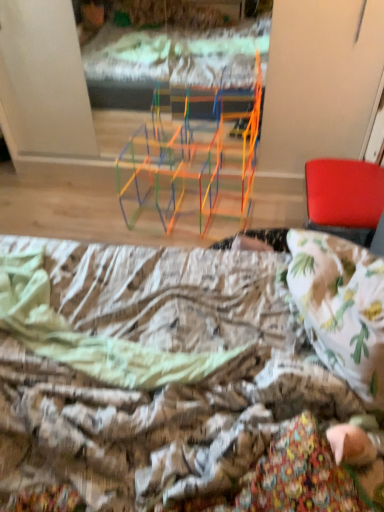
Question: Looking at their shapes, would you say red leather chair at right is wider or thinner than printed fabric bed at lower center?

Choices:
 (A) wide
 (B) thin

Answer: (B)

Question: Visually, is red leather chair at right positioned to the left or to the right of printed fabric bed at lower center?

Choices:
 (A) right
 (B) left

Answer: (A)

Question: From the image's perspective, is red leather chair at right above or below printed fabric bed at lower center?

Choices:
 (A) above
 (B) below

Answer: (A)

Question: Based on their sizes in the image, would you say printed fabric bed at lower center is bigger or smaller than red leather chair at right?

Choices:
 (A) small
 (B) big

Answer: (B)

Question: From the image's perspective, relative to red leather chair at right, is printed fabric bed at lower center above or below?

Choices:
 (A) below
 (B) above

Answer: (A)

Question: Would you say printed fabric bed at lower center is inside or outside red leather chair at right?

Choices:
 (A) outside
 (B) inside

Answer: (A)

Question: Is printed fabric bed at lower center wider or thinner than red leather chair at right?

Choices:
 (A) thin
 (B) wide

Answer: (B)